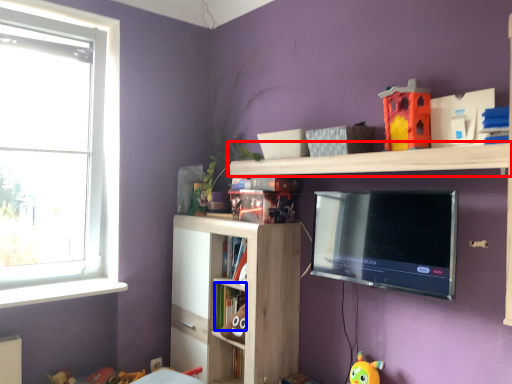
Question: Which object appears farthest to the camera in this image, shelf (highlighted by a red box) or book (highlighted by a blue box)?

Choices:
 (A) shelf
 (B) book

Answer: (B)